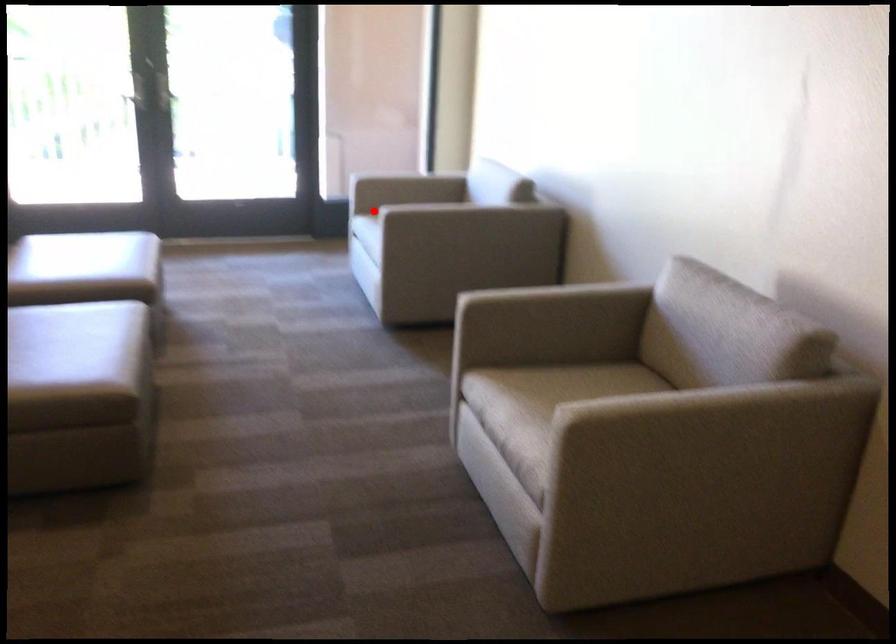
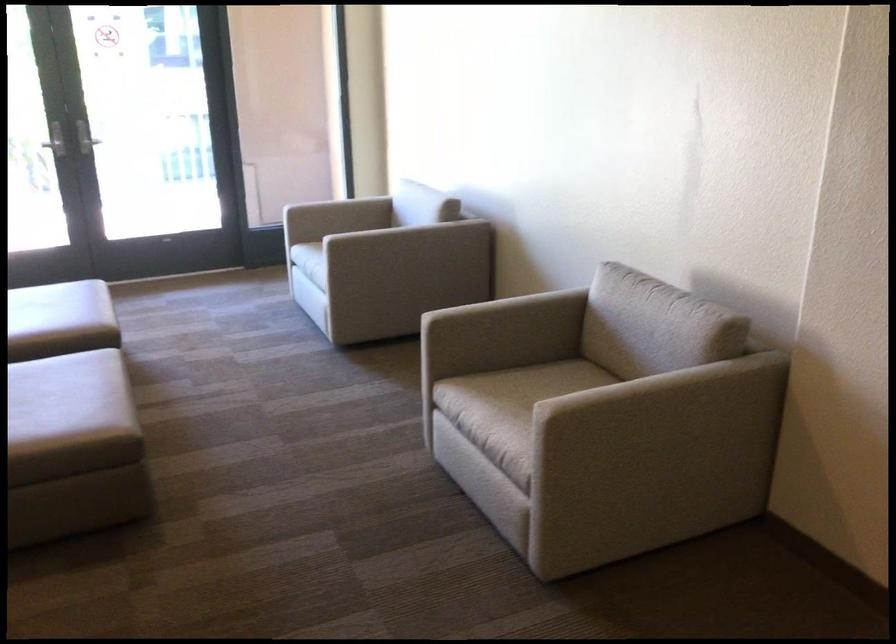
Locate, in the second image, the point that corresponds to the highlighted location in the first image.

(316, 240)